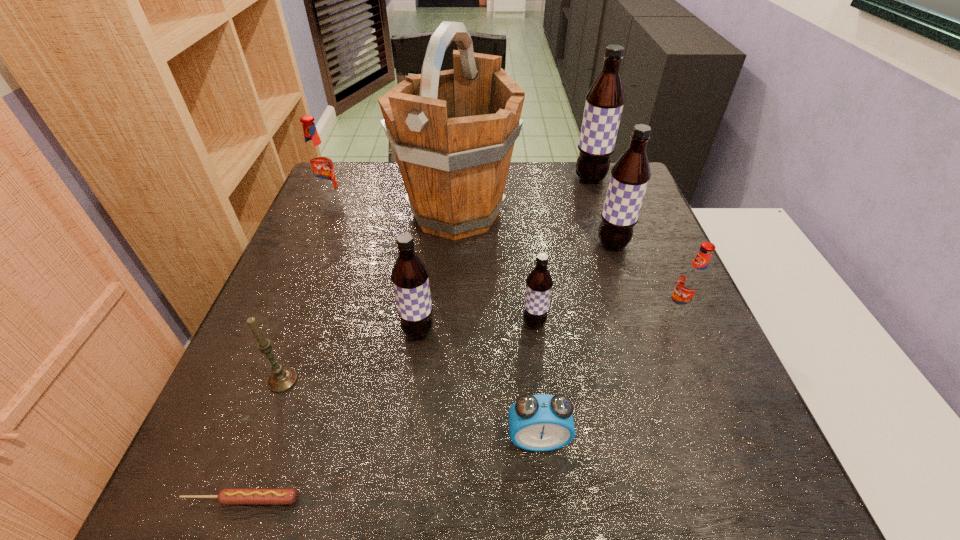
Where is `the right red root beer`? The height and width of the screenshot is (540, 960). the right red root beer is located at coordinates (692, 281).

The image size is (960, 540). What are the coordinates of `the third root beer from left to right` in the screenshot? It's located at (539, 282).

Find the location of a particular element. Image resolution: width=960 pixels, height=540 pixels. the second brown root beer from left to right is located at coordinates (539, 282).

You are a GUI agent. You are given a task and a screenshot of the screen. Output one action in this format:
    pyautogui.click(x=<x>, y=<y>)
    Task: Click on the candle
    Image resolution: width=960 pixels, height=540 pixels.
    Given the screenshot: What is the action you would take?
    pyautogui.click(x=282, y=378)

Locate an element on the screen. The width and height of the screenshot is (960, 540). alarm clock is located at coordinates (542, 422).

Identify the location of the ninth farthest object. This screenshot has height=540, width=960. (542, 422).

Image resolution: width=960 pixels, height=540 pixels. What are the coordinates of `sausage` in the screenshot? It's located at (230, 496).

Where is `brown sausage`? The height and width of the screenshot is (540, 960). brown sausage is located at coordinates (230, 496).

You are a GUI agent. You are given a task and a screenshot of the screen. Output one action in this format:
    pyautogui.click(x=<x>, y=<y>)
    Task: Click on the free space located on the front of the bucket
    This screenshot has width=960, height=540.
    Given the screenshot: What is the action you would take?
    pyautogui.click(x=447, y=340)

Identify the location of free space located on the left of the tallest root beer. This screenshot has height=540, width=960. (497, 179).